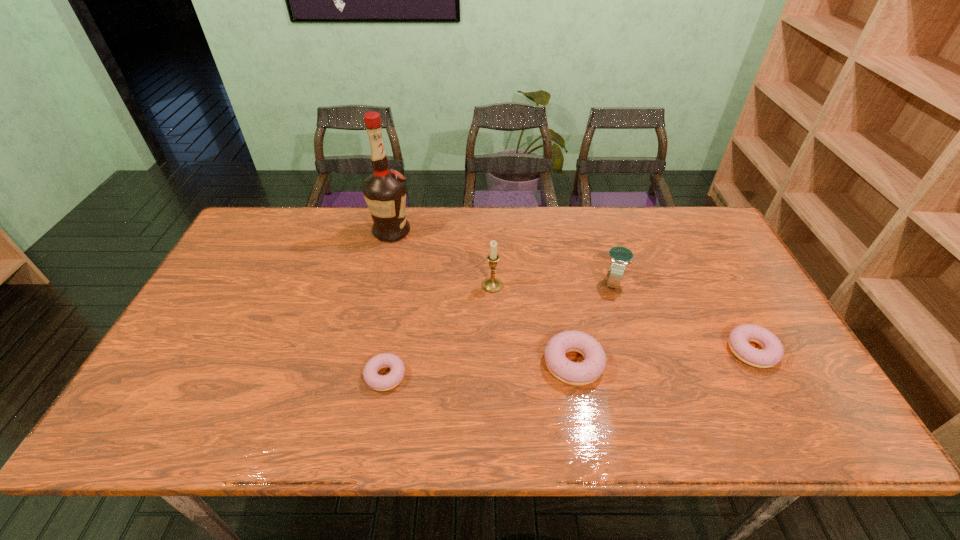
Point out which doughnut is positioned as the third nearest to the tallest object. Please provide its 2D coordinates. Your answer should be formatted as a tuple, i.e. [(x, y)], where the tuple contains the x and y coordinates of a point satisfying the conditions above.

[(772, 353)]

Find the location of a particular element. doughnut identified as the second closest to the third object from right to left is located at coordinates (377, 382).

Identify the location of vacant area in the image that satisfies the following two spatial constraints: 1. on the front and back of the liquor; 2. on the left side of the candle holder. The height and width of the screenshot is (540, 960). (379, 286).

This screenshot has width=960, height=540. I want to click on vacant position in the image that satisfies the following two spatial constraints: 1. on the front and back of the farthest object; 2. on the right side of the watch, so 380,282.

Locate an element on the screen. The image size is (960, 540). vacant space that satisfies the following two spatial constraints: 1. on the front and back of the second shortest doughnut; 2. on the right side of the farthest object is located at coordinates (364, 351).

Find the location of `vacant space that satisfies the following two spatial constraints: 1. on the back side of the rightmost object; 2. on the right side of the leftmost doughnut`. vacant space that satisfies the following two spatial constraints: 1. on the back side of the rightmost object; 2. on the right side of the leftmost doughnut is located at coordinates (390, 351).

You are a GUI agent. You are given a task and a screenshot of the screen. Output one action in this format:
    pyautogui.click(x=<x>, y=<y>)
    Task: Click on the vacant region that satisfies the following two spatial constraints: 1. on the front and back of the watch; 2. on the left side of the liquor
    
    Given the screenshot: What is the action you would take?
    pyautogui.click(x=380, y=282)

Find the location of a particular element. vacant space that satisfies the following two spatial constraints: 1. on the front and back of the liquor; 2. on the right side of the second tallest object is located at coordinates (379, 286).

The height and width of the screenshot is (540, 960). I want to click on free location that satisfies the following two spatial constraints: 1. on the back side of the second shortest object; 2. on the right side of the tallest doughnut, so pyautogui.click(x=571, y=351).

At what (x,y) coordinates should I click in order to perform the action: click on vacant position in the image that satisfies the following two spatial constraints: 1. on the front side of the fifth shortest object; 2. on the left side of the second doughnut from right to left. Please return your answer as a coordinate pair (x, y). Image resolution: width=960 pixels, height=540 pixels. Looking at the image, I should click on (494, 363).